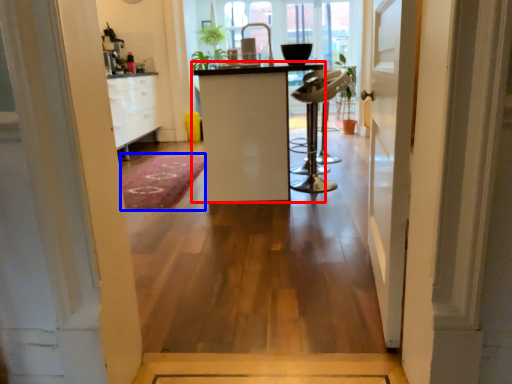
Question: Which object is further to the camera taking this photo, furniture (highlighted by a red box) or doormat (highlighted by a blue box)?

Choices:
 (A) furniture
 (B) doormat

Answer: (B)